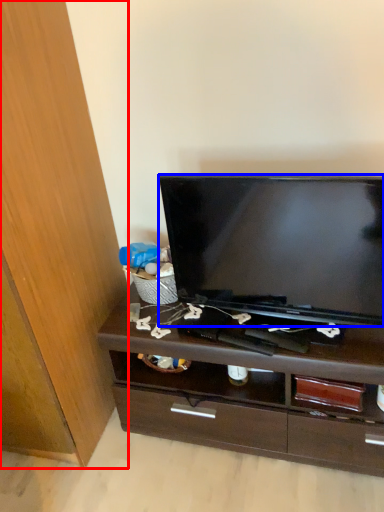
Question: Which point is further to the camera, cabinetry (highlighted by a red box) or television (highlighted by a blue box)?

Choices:
 (A) cabinetry
 (B) television

Answer: (B)